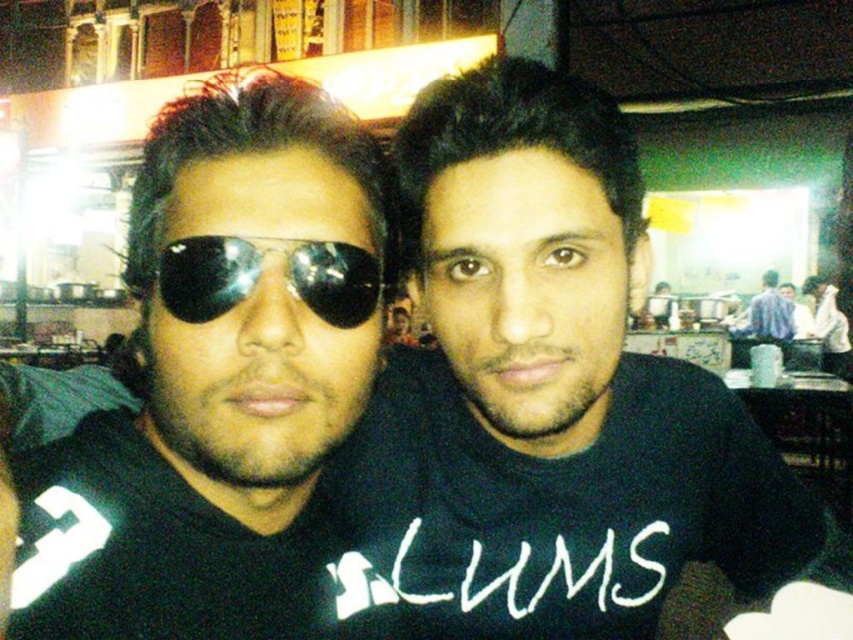
Is shiny black goggles at center to the right of blue shirt at right from the viewer's perspective?

No, shiny black goggles at center is not to the right of blue shirt at right.

Between shiny black goggles at center and blue shirt at right, which one has less height?

With less height is shiny black goggles at center.

Find the location of a particular element. This screenshot has height=640, width=853. shiny black goggles at center is located at coordinates (260, 273).

Can you confirm if matte black sunglasses at left is positioned to the right of blue shirt at right?

No, matte black sunglasses at left is not to the right of blue shirt at right.

Measure the distance between matte black sunglasses at left and camera.

matte black sunglasses at left is 15.02 feet away from camera.

Is point (263, 630) positioned after point (755, 310)?

No, (263, 630) is in front of (755, 310).

Locate an element on the screen. Image resolution: width=853 pixels, height=640 pixels. matte black sunglasses at left is located at coordinates (222, 387).

Does point (810, 550) come closer to viewer compared to point (306, 305)?

No, it is not.

Is black matte shirt at center bigger than shiny black goggles at center?

Indeed, black matte shirt at center has a larger size compared to shiny black goggles at center.

The height and width of the screenshot is (640, 853). What are the coordinates of `black matte shirt at center` in the screenshot? It's located at (547, 394).

The height and width of the screenshot is (640, 853). Identify the location of black matte shirt at center. (547, 394).